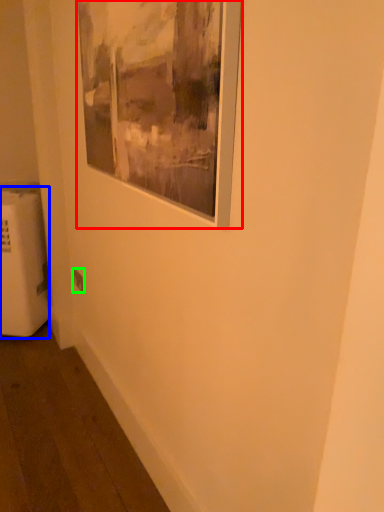
Question: Estimate the real-world distances between objects in this image. Which object is closer to picture frame (highlighted by a red box), radiator (highlighted by a blue box) or electric outlet (highlighted by a green box)?

Choices:
 (A) radiator
 (B) electric outlet

Answer: (B)